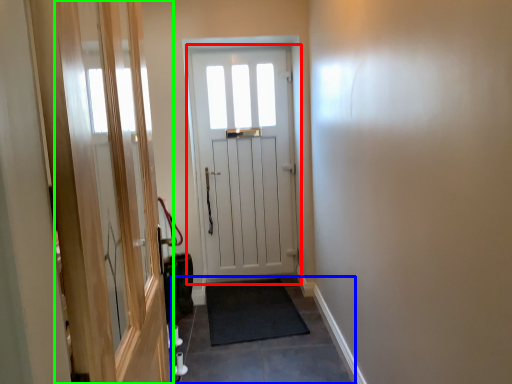
Question: Based on their relative distances, which object is nearer to door (highlighted by a red box)? Choose from path (highlighted by a blue box) and screen door (highlighted by a green box).

Choices:
 (A) path
 (B) screen door

Answer: (A)